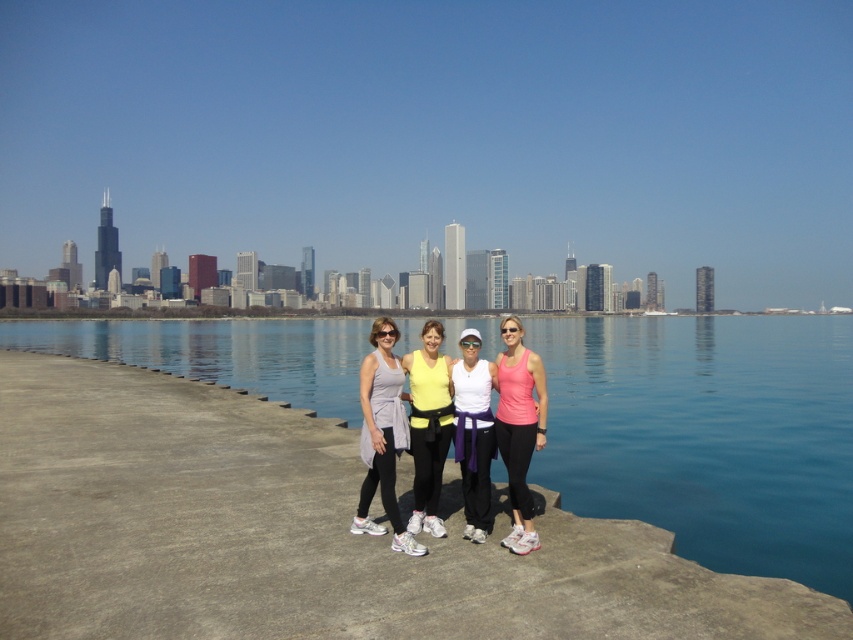
Question: Which object is farther from the camera taking this photo?

Choices:
 (A) blue smooth water at center
 (B) pink matte tank top at center
 (C) matte gray tank top at center

Answer: (A)

Question: Which object is positioned closest to the white matte tank top at center?

Choices:
 (A) blue smooth water at center
 (B) matte gray tank top at center
 (C) pink matte tank top at center

Answer: (C)

Question: Does blue smooth water at center have a greater width compared to white matte tank top at center?

Choices:
 (A) no
 (B) yes

Answer: (B)

Question: Is blue smooth water at center wider than white matte tank top at center?

Choices:
 (A) no
 (B) yes

Answer: (B)

Question: Estimate the real-world distances between objects in this image. Which object is closer to the white matte tank top at center?

Choices:
 (A) blue smooth water at center
 (B) pink matte tank top at center
 (C) matte yellow tank top at center
 (D) matte gray tank top at center

Answer: (C)

Question: Is matte yellow tank top at center above white matte tank top at center?

Choices:
 (A) no
 (B) yes

Answer: (B)